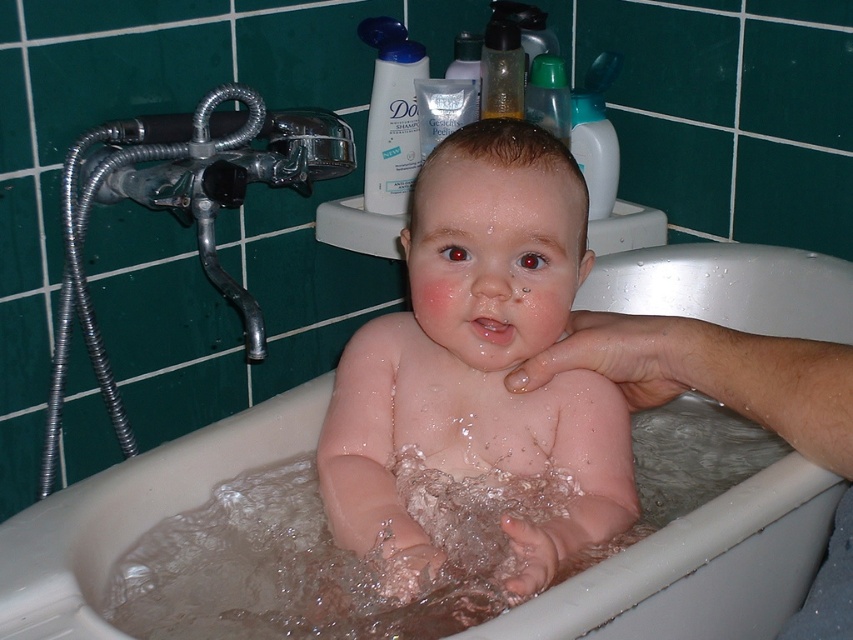
You are a parent trying to locate your baby during bath time. You remember the baby was in the white bathtub, and you recall that the pink smooth skin at center is exactly at point (x=479, y=364). Can you confirm if the baby is in the correct position for bathing?

The pink smooth skin at center is located at point (x=479, y=364), which indicates the baby is in the correct position for bathing in the white bathtub.

You are a photographer taking a picture of the baby in the bathtub. You notice two points in the scene at coordinates point (500,346) and point (252,452). Which point will appear larger in your photo?

Point (500,346) is closer to the camera than point (252,452), so it will appear larger in the photo.

You are a parent checking the baby bath setup. The baby has pink smooth skin at center and is in the white plastic bathtub at center. Considering the size difference between the baby and the bathtub, is the bathtub suitable for the baby?

The pink smooth skin at center has a larger size compared to the white plastic bathtub at center, so the bathtub may not be suitable as the baby is larger than the bathtub.